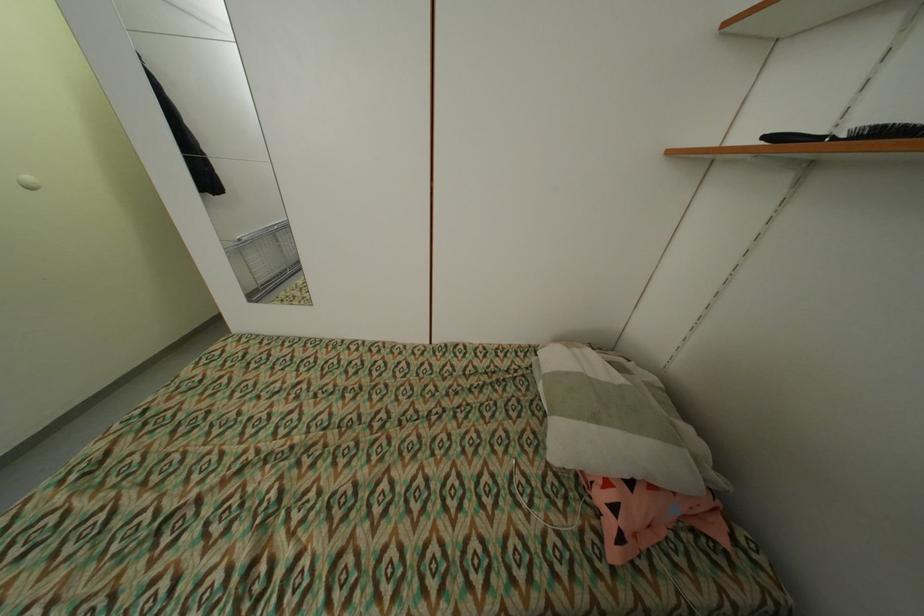
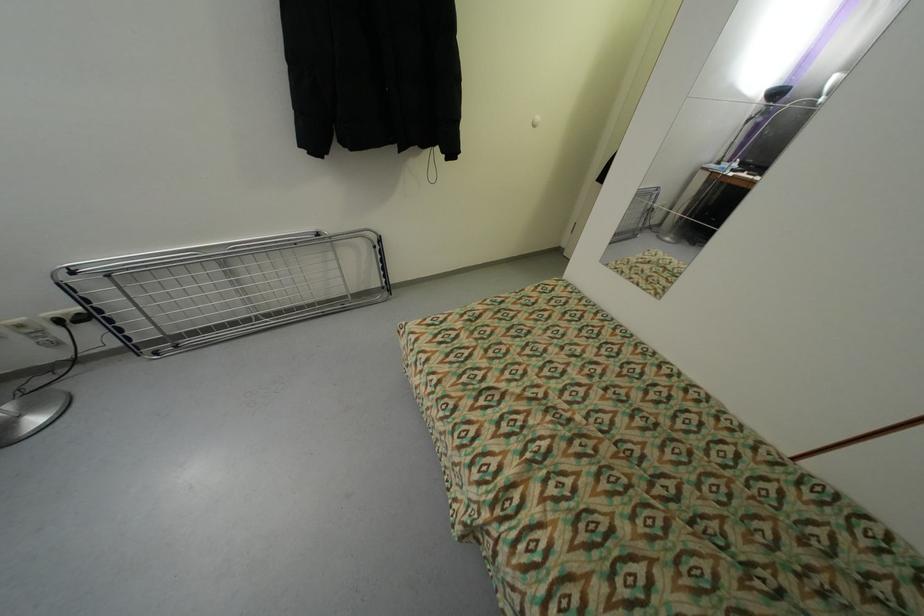
How did the camera likely rotate?

The rotation direction of the camera is left-down.